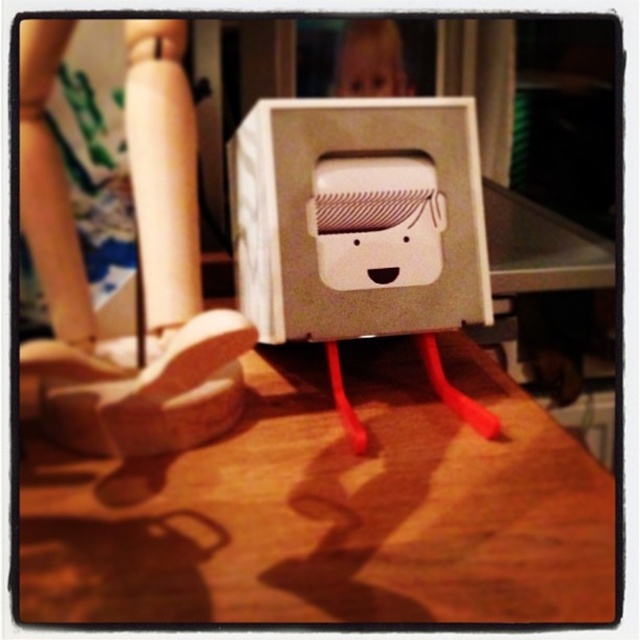
You are standing at the origin point in the image, which is the bottom left corner. You want to place a new object at the same position as the white cardboard box at center. What coordinates should you use?

The white cardboard box at center is located at coordinates point (358, 218), so you should place the new object at coordinates (358, 218).

You are standing in front of the whimsical robot figure. You see the white cardboard box at center and the matte plastic face at upper center. Which object is nearer to you?

The white cardboard box at center is closer to the viewer than the matte plastic face at upper center, so the white cardboard box at center is nearer to you.